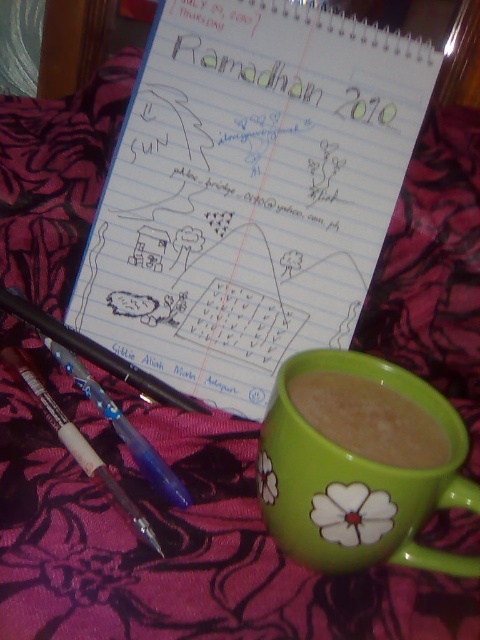
Question: Does white lined paper at center appear under green ceramic mug at center?

Choices:
 (A) yes
 (B) no

Answer: (B)

Question: Is green ceramic mug at center above white plastic pen at lower left?

Choices:
 (A) yes
 (B) no

Answer: (A)

Question: Among these objects, which one is farthest from the camera?

Choices:
 (A) green matte mug at lower right
 (B) green ceramic mug at center
 (C) white lined paper at center
 (D) white plastic pen at lower left

Answer: (C)

Question: Which object is the closest to the green matte mug at lower right?

Choices:
 (A) white lined paper at center
 (B) white plastic pen at lower left
 (C) green ceramic mug at center

Answer: (C)

Question: Which object is farther from the camera taking this photo?

Choices:
 (A) white lined paper at center
 (B) white plastic pen at lower left
 (C) green matte mug at lower right
 (D) green ceramic mug at center

Answer: (A)

Question: In this image, where is white lined paper at center located relative to green ceramic mug at center?

Choices:
 (A) right
 (B) left

Answer: (B)